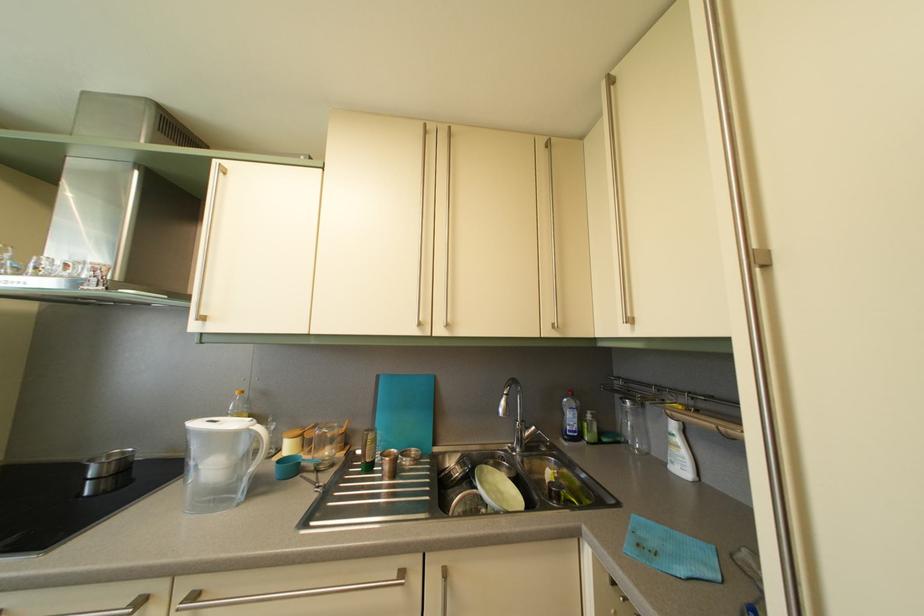
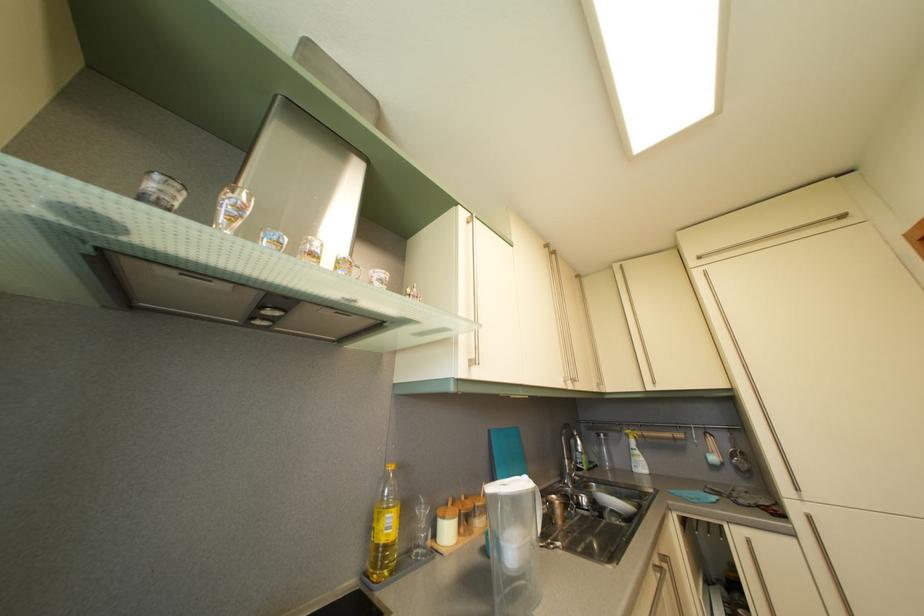
Where in the second image is the point corresponding to the point at 633,408 from the first image?

(608, 444)